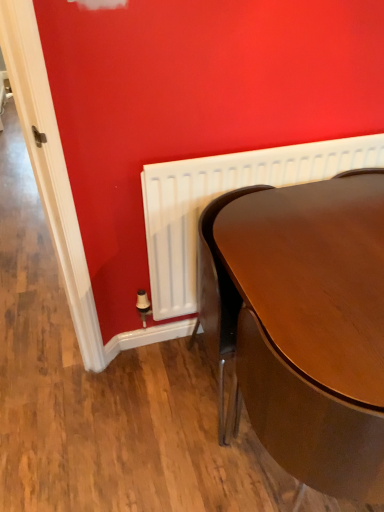
Identify the location of free space above glossy wood table at right (from a real-world perspective). (327, 246).